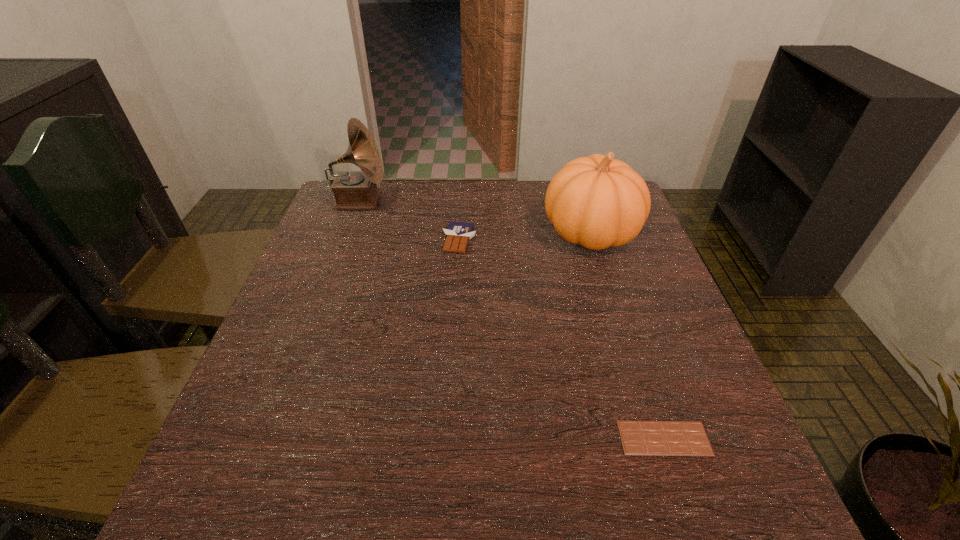
Image resolution: width=960 pixels, height=540 pixels. What are the coordinates of `the leftmost object` in the screenshot? It's located at (352, 189).

Find the location of a particular element. This screenshot has height=540, width=960. pumpkin is located at coordinates (597, 201).

At what (x,y) coordinates should I click in order to perform the action: click on the second object from left to right. Please return your answer as a coordinate pair (x, y). Looking at the image, I should click on (458, 234).

At what (x,y) coordinates should I click in order to perform the action: click on the left chocolate bar. Please return your answer as a coordinate pair (x, y). This screenshot has height=540, width=960. Looking at the image, I should click on (458, 234).

Locate an element on the screen. The image size is (960, 540). the shorter chocolate bar is located at coordinates (639, 438).

Locate an element on the screen. This screenshot has width=960, height=540. the right chocolate bar is located at coordinates (639, 438).

The width and height of the screenshot is (960, 540). Find the location of `vacant position located on the horn of the phonograph record`. vacant position located on the horn of the phonograph record is located at coordinates (511, 201).

The width and height of the screenshot is (960, 540). Find the location of `vacant position located 0.150m on the left of the pumpkin`. vacant position located 0.150m on the left of the pumpkin is located at coordinates (487, 232).

Where is `blank space located 0.180m on the left of the taller chocolate bar`? The height and width of the screenshot is (540, 960). blank space located 0.180m on the left of the taller chocolate bar is located at coordinates (374, 240).

Identify the location of vacant region located on the back of the right chocolate bar. This screenshot has width=960, height=540. (637, 357).